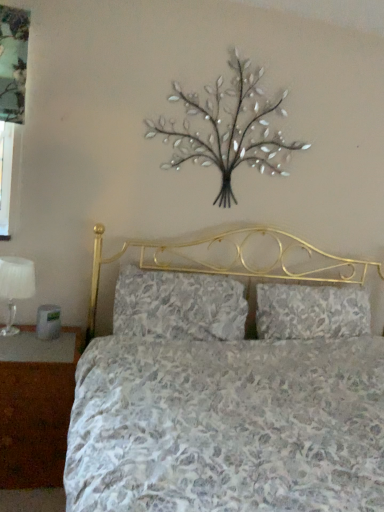
Question: Are white fabric lampshade at left and brown wood nightstand at lower left making contact?

Choices:
 (A) no
 (B) yes

Answer: (A)

Question: Would you say white fabric lampshade at left contains brown wood nightstand at lower left?

Choices:
 (A) yes
 (B) no

Answer: (B)

Question: From a real-world perspective, is white fabric lampshade at left on top of brown wood nightstand at lower left?

Choices:
 (A) no
 (B) yes

Answer: (B)

Question: Considering the relative sizes of white fabric lampshade at left and brown wood nightstand at lower left in the image provided, is white fabric lampshade at left bigger than brown wood nightstand at lower left?

Choices:
 (A) no
 (B) yes

Answer: (A)

Question: Can you confirm if white fabric lampshade at left is thinner than brown wood nightstand at lower left?

Choices:
 (A) no
 (B) yes

Answer: (B)

Question: From a real-world perspective, relative to metallic silver tree at upper center, is floral fabric pillow at center, the second pillow from the right, vertically above or below?

Choices:
 (A) below
 (B) above

Answer: (A)

Question: Considering the positions of floral fabric pillow at center, which is counted as the first pillow, starting from the left, and metallic silver tree at upper center in the image, is floral fabric pillow at center, which is counted as the first pillow, starting from the left, taller or shorter than metallic silver tree at upper center?

Choices:
 (A) tall
 (B) short

Answer: (B)

Question: Is floral fabric pillow at center, the second pillow from the right, situated inside metallic silver tree at upper center or outside?

Choices:
 (A) outside
 (B) inside

Answer: (A)

Question: Considering the relative positions of floral fabric pillow at center, which is counted as the first pillow, starting from the left, and metallic silver tree at upper center in the image provided, is floral fabric pillow at center, which is counted as the first pillow, starting from the left, to the left or to the right of metallic silver tree at upper center?

Choices:
 (A) right
 (B) left

Answer: (B)

Question: Is floral fabric pillow at center, the 1th pillow viewed from the right, wider or thinner than white fabric lampshade at left?

Choices:
 (A) thin
 (B) wide

Answer: (B)

Question: From a real-world perspective, is floral fabric pillow at center, placed as the second pillow when sorted from left to right, positioned above or below white fabric lampshade at left?

Choices:
 (A) below
 (B) above

Answer: (B)

Question: Does point (360, 288) appear closer or farther from the camera than point (6, 324)?

Choices:
 (A) farther
 (B) closer

Answer: (A)

Question: Is floral fabric pillow at center, placed as the second pillow when sorted from left to right, to the left or to the right of white fabric lampshade at left in the image?

Choices:
 (A) left
 (B) right

Answer: (B)

Question: Is floral fabric pillow at center, placed as the second pillow when sorted from left to right, situated inside metallic silver tree at upper center or outside?

Choices:
 (A) inside
 (B) outside

Answer: (B)

Question: From a real-world perspective, relative to metallic silver tree at upper center, is floral fabric pillow at center, placed as the second pillow when sorted from left to right, vertically above or below?

Choices:
 (A) above
 (B) below

Answer: (B)